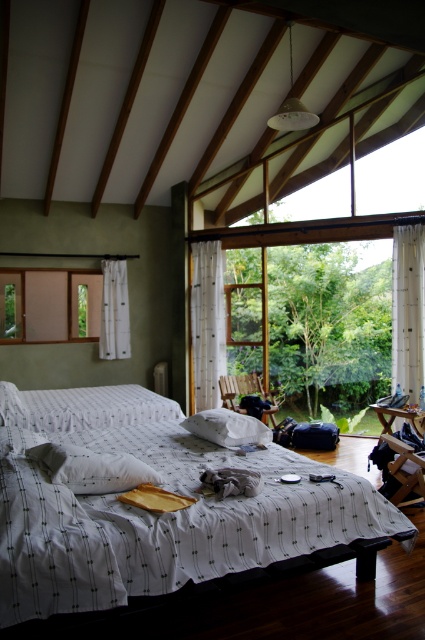
Question: Is wooden rocking chair at center positioned at the back of white sheer curtain at left?

Choices:
 (A) yes
 (B) no

Answer: (B)

Question: Is white sheer curtain at left positioned behind white fluffy pillow at center?

Choices:
 (A) yes
 (B) no

Answer: (A)

Question: Does wooden frame window at left have a smaller size compared to white sheer curtain at right?

Choices:
 (A) no
 (B) yes

Answer: (B)

Question: Which of the following is the closest to the observer?

Choices:
 (A) white sheer curtain at left
 (B) white sheer curtain at center
 (C) white textured bed at center

Answer: (C)

Question: Which of these objects is positioned closest to the white sheer curtain at center?

Choices:
 (A) white sheer curtain at left
 (B) wooden chair at center

Answer: (B)

Question: Among these objects, which one is farthest from the camera?

Choices:
 (A) wooden rocking chair at center
 (B) white sheer curtain at left

Answer: (B)